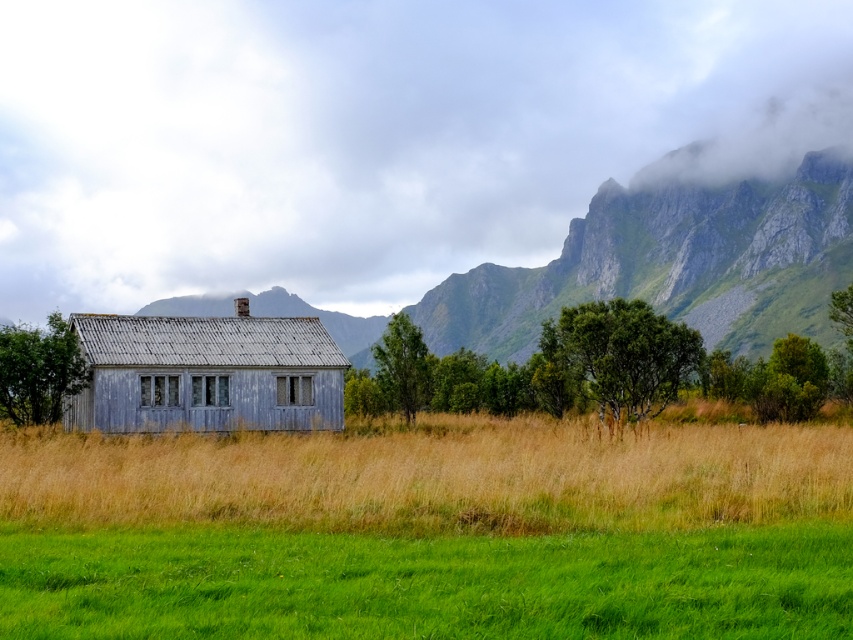
Question: Observing the image, what is the correct spatial positioning of grassy field at center in reference to rugged stone mountain at center?

Choices:
 (A) below
 (B) above

Answer: (A)

Question: Among these objects, which one is nearest to the camera?

Choices:
 (A) grassy field at center
 (B) rugged stone mountain at center

Answer: (A)

Question: Which point is farther to the camera?

Choices:
 (A) grassy field at center
 (B) weathered wood hut at center

Answer: (B)

Question: Is grassy field at center bigger than rugged stone mountain at center?

Choices:
 (A) yes
 (B) no

Answer: (B)

Question: Considering the real-world distances, which object is closest to the rugged stone mountain at center?

Choices:
 (A) grassy field at center
 (B) weathered wood hut at center

Answer: (B)

Question: Is grassy field at center further to camera compared to weathered wood hut at center?

Choices:
 (A) no
 (B) yes

Answer: (A)